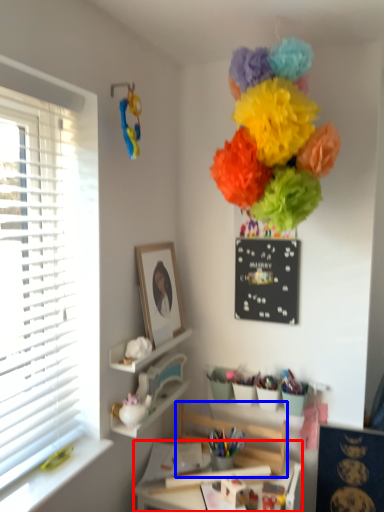
Question: Which object appears closest to the camera in this image, table (highlighted by a red box) or swivel chair (highlighted by a blue box)?

Choices:
 (A) table
 (B) swivel chair

Answer: (A)